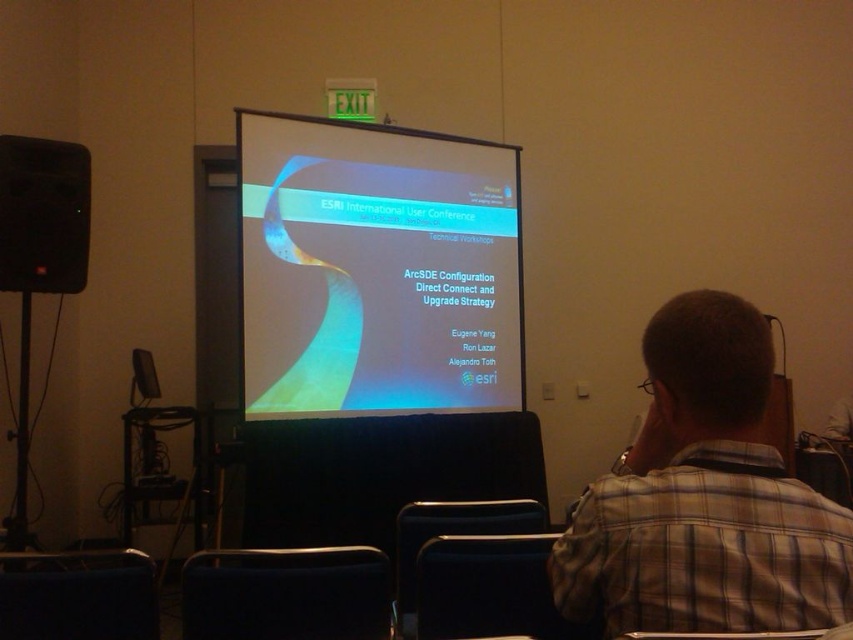
Question: Is matte plastic screen at center above plaid shirt at center?

Choices:
 (A) no
 (B) yes

Answer: (B)

Question: Which point appears closest to the camera in this image?

Choices:
 (A) (521, 371)
 (B) (33, 154)

Answer: (B)

Question: Among these points, which one is farthest from the camera?

Choices:
 (A) (15, 179)
 (B) (407, 212)
 (C) (798, 525)

Answer: (B)

Question: Can you confirm if matte plastic screen at center is positioned to the left of plaid shirt at center?

Choices:
 (A) yes
 (B) no

Answer: (A)

Question: Which object is closer to the camera taking this photo?

Choices:
 (A) plaid shirt at center
 (B) matte plastic screen at center

Answer: (A)

Question: Does plaid shirt at center lie in front of black matte speaker at left?

Choices:
 (A) no
 (B) yes

Answer: (B)